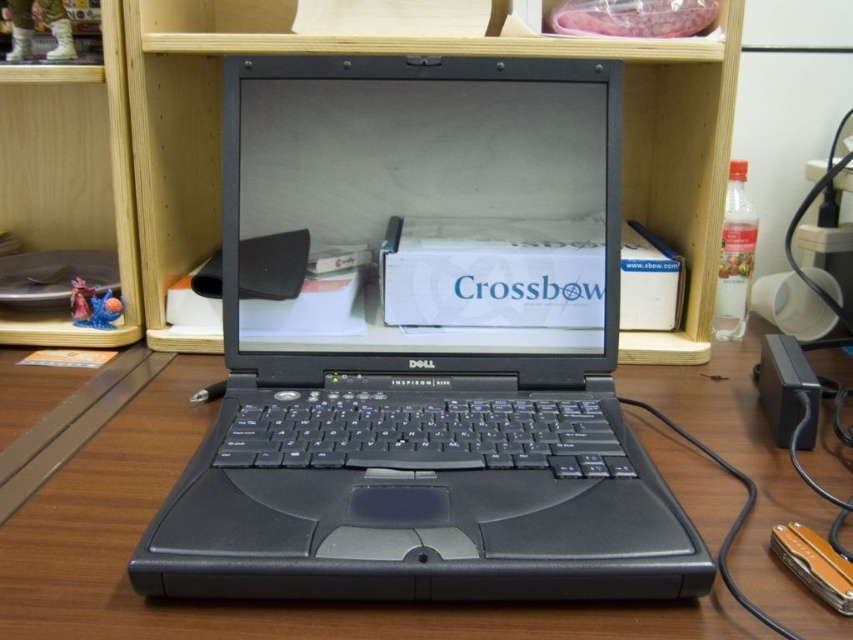
You have a rectangular object that is 15 cm in length and needs to be placed on the wooden table at center. The black rubber mouse at center is currently occupying some space. Can the object be placed without overlapping the mouse?

The wooden table at center might be wider than black rubber mouse at center, so it is possible that the 15 cm object can be placed without overlapping the mouse. However, the exact positioning depends on their specific widths.

What is the position of the wooden bookshelf at upper left in the image?

The wooden bookshelf at upper left is located at point [70,179].

You are a delivery person who just arrived at the office. You need to place a package on the wooden table at center. Where exactly should you place it?

The wooden table at center is located at the 2D coordinates point (245, 602), so place the package there.